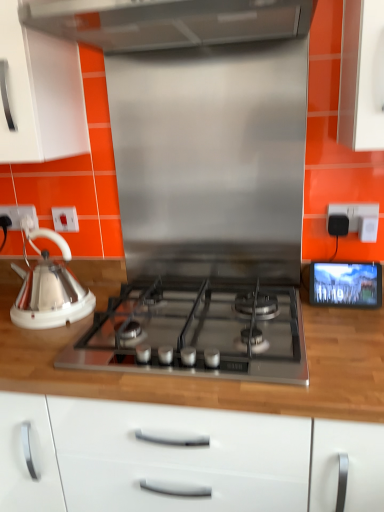
What do you see at coordinates (65, 219) in the screenshot?
I see `white plastic electrical outlet at left, the 2th electric outlet in the right-to-left sequence` at bounding box center [65, 219].

Identify the location of wooden at left. (214, 378).

Locate an element on the screen. The height and width of the screenshot is (512, 384). black plastic electric outlet at upper right, the 1th electric outlet positioned from the right is located at coordinates (342, 219).

The width and height of the screenshot is (384, 512). Describe the element at coordinates (346, 284) in the screenshot. I see `matte black screen at right` at that location.

At what (x,y) coordinates should I click in order to perform the action: click on white plastic electrical outlet at left, the second electric outlet from the back. Please return your answer as a coordinate pair (x, y). Image resolution: width=384 pixels, height=512 pixels. Looking at the image, I should click on (65, 219).

Based on the photo, considering their positions, is satin silver gas stove at center located in front of or behind white glossy kettle at left?

In the image, satin silver gas stove at center appears in front of white glossy kettle at left.

Where is `kettle above the satin silver gas stove at center (from the image's perspective)`? The height and width of the screenshot is (512, 384). kettle above the satin silver gas stove at center (from the image's perspective) is located at coordinates (50, 297).

From the image's perspective, is satin silver gas stove at center above or below white glossy kettle at left?

satin silver gas stove at center is situated lower than white glossy kettle at left in the image.

Based on their sizes in the image, would you say white plastic socket at left, acting as the 1th electric outlet starting from the left, is bigger or smaller than wooden at left?

In the image, white plastic socket at left, acting as the 1th electric outlet starting from the left, appears to be smaller than wooden at left.

Is white plastic socket at left, acting as the 1th electric outlet starting from the left, not inside wooden at left?

Yes, white plastic socket at left, acting as the 1th electric outlet starting from the left, is not within wooden at left.

Does white plastic socket at left, the third electric outlet viewed from the front, have a lesser height compared to wooden at left?

Indeed, white plastic socket at left, the third electric outlet viewed from the front, has a lesser height compared to wooden at left.

Can you confirm if matte black screen at right is taller than black plastic electric outlet at upper right, the 1th electric outlet positioned from the right?

Indeed, matte black screen at right has a greater height compared to black plastic electric outlet at upper right, the 1th electric outlet positioned from the right.

Find the location of a particular element. This screenshot has height=512, width=384. screen lying on the left of black plastic electric outlet at upper right, the 1th electric outlet positioned from the right is located at coordinates tap(346, 284).

From a real-world perspective, is matte black screen at right on black plastic electric outlet at upper right, which ranks as the third electric outlet in left-to-right order?

No.

Is black plastic electric outlet at upper right, the 1th electric outlet positioned from the right, a part of matte black screen at right?

Definitely not — black plastic electric outlet at upper right, the 1th electric outlet positioned from the right, is not inside matte black screen at right.

Which point is more distant from viewer, [203,344] or [305,304]?

The point [305,304] is behind.

Does satin silver gas stove at center come in front of wooden at left?

No, it is behind wooden at left.

Image resolution: width=384 pixels, height=512 pixels. What are the coordinates of `countertop that appears on the left of satin silver gas stove at center` in the screenshot? It's located at (214, 378).

Is satin silver gas stove at center with wooden at left?

No, satin silver gas stove at center is not making contact with wooden at left.

From a real-world perspective, between wooden at left and white glossy kettle at left, who is vertically lower?

wooden at left is physically lower.

Does wooden at left turn towards white glossy kettle at left?

No, wooden at left is not oriented towards white glossy kettle at left.

Is point (247, 390) positioned in front of point (51, 265)?

That is True.

Is wooden at left directly adjacent to white glossy kettle at left?

wooden at left is not next to white glossy kettle at left, and they're not touching.

In the scene shown: Which object is positioned more to the right, matte black screen at right or satin silver gas stove at center?

From the viewer's perspective, matte black screen at right appears more on the right side.

Between matte black screen at right and satin silver gas stove at center, which one has more height?

Standing taller between the two is matte black screen at right.

Is matte black screen at right smaller than satin silver gas stove at center?

Indeed, matte black screen at right has a smaller size compared to satin silver gas stove at center.

Is matte black screen at right far from satin silver gas stove at center?

No, matte black screen at right is not far from satin silver gas stove at center.

Can you confirm if satin silver gas stove at center is taller than black plastic electric outlet at upper right, the 3th electric outlet when ordered from back to front?

Indeed, satin silver gas stove at center has a greater height compared to black plastic electric outlet at upper right, the 3th electric outlet when ordered from back to front.

Relative to black plastic electric outlet at upper right, the first electric outlet when ordered from front to back, is satin silver gas stove at center in front or behind?

In the image, satin silver gas stove at center appears in front of black plastic electric outlet at upper right, the first electric outlet when ordered from front to back.

Considering the sizes of satin silver gas stove at center and black plastic electric outlet at upper right, the first electric outlet when ordered from front to back, in the image, is satin silver gas stove at center wider or thinner than black plastic electric outlet at upper right, the first electric outlet when ordered from front to back,?

Clearly, satin silver gas stove at center has more width compared to black plastic electric outlet at upper right, the first electric outlet when ordered from front to back.

At what (x,y) coordinates should I click in order to perform the action: click on gas stove that appears below the white glossy kettle at left (from a real-world perspective). Please return your answer as a coordinate pair (x, y). Looking at the image, I should click on (197, 331).

From the image's perspective, starting from the wooden at left, which electric outlet is the 3rd one above? Please provide its 2D coordinates.

[(20, 215)]

From the image, which object appears to be nearer to white plastic socket at left, the third electric outlet viewed from the front, white plastic electrical outlet at left, the second electric outlet from the back, or white glossy kettle at left?

The object closer to white plastic socket at left, the third electric outlet viewed from the front, is white plastic electrical outlet at left, the second electric outlet from the back.

Which object lies further to the anchor point matte black screen at right, white plastic electrical outlet at left, the second electric outlet from the back, or white glossy kettle at left?

white plastic electrical outlet at left, the second electric outlet from the back.

Consider the image. Considering their positions, is white glossy kettle at left positioned further to wooden at left than white plastic electrical outlet at left, arranged as the second electric outlet when viewed from the left?

white plastic electrical outlet at left, arranged as the second electric outlet when viewed from the left, is further to wooden at left.

From the image, which object appears to be farther from white plastic electrical outlet at left, the 2th electric outlet in the right-to-left sequence, black plastic electric outlet at upper right, the 1th electric outlet positioned from the right, or satin silver gas stove at center?

black plastic electric outlet at upper right, the 1th electric outlet positioned from the right, lies further to white plastic electrical outlet at left, the 2th electric outlet in the right-to-left sequence, than the other object.

When comparing their distances from white glossy kettle at left, does white plastic electrical outlet at left, arranged as the second electric outlet when viewed from the left, or matte black screen at right seem further?

matte black screen at right.

Looking at the image, which one is located further to black plastic electric outlet at upper right, the first electric outlet when ordered from front to back, wooden at left or satin silver gas stove at center?

wooden at left is positioned further to the anchor black plastic electric outlet at upper right, the first electric outlet when ordered from front to back.

Based on their spatial positions, is wooden at left or satin silver gas stove at center further from matte black screen at right?

The object further to matte black screen at right is satin silver gas stove at center.

Looking at the image, which one is located closer to white glossy kettle at left, white plastic socket at left, which is the third electric outlet in right-to-left order, or white plastic electrical outlet at left, arranged as the second electric outlet when viewed from the left?

The object closer to white glossy kettle at left is white plastic socket at left, which is the third electric outlet in right-to-left order.

Where is `kettle between white plastic socket at left, the third electric outlet viewed from the front, and matte black screen at right, in the horizontal direction`? This screenshot has height=512, width=384. kettle between white plastic socket at left, the third electric outlet viewed from the front, and matte black screen at right, in the horizontal direction is located at coordinates (50, 297).

Identify the location of gas stove between white glossy kettle at left and wooden at left vertically. (197, 331).

Find the location of a particular element. This screenshot has width=384, height=512. kettle positioned between wooden at left and white plastic socket at left, the first electric outlet when ordered from back to front, from near to far is located at coordinates (50, 297).

Identify the location of electric outlet between white glossy kettle at left and matte black screen at right from left to right. (65, 219).